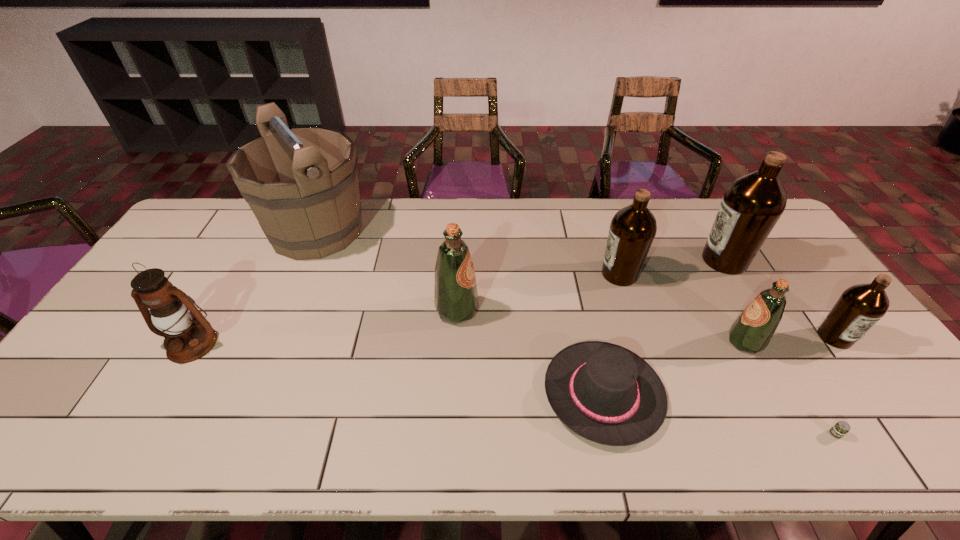
Find the location of a particular element. This screenshot has width=960, height=540. brown olive oil that is the closest one to the nearer green olive oil is located at coordinates (861, 306).

Where is `brown olive oil that stands as the second closest to the shortest object`? brown olive oil that stands as the second closest to the shortest object is located at coordinates (751, 206).

This screenshot has height=540, width=960. In order to click on vacant space that satisfies the following two spatial constraints: 1. on the label of the tallest olive oil; 2. on the back side of the beer can in this screenshot , I will do `click(828, 434)`.

Image resolution: width=960 pixels, height=540 pixels. Identify the location of vacant area in the image that satisfies the following two spatial constraints: 1. on the label of the rightmost brown olive oil; 2. on the front-facing side of the nearer green olive oil. (838, 342).

In order to click on vacant area in the image that satisfies the following two spatial constraints: 1. on the front-facing side of the right green olive oil; 2. on the back side of the beer can in this screenshot , I will do `click(795, 434)`.